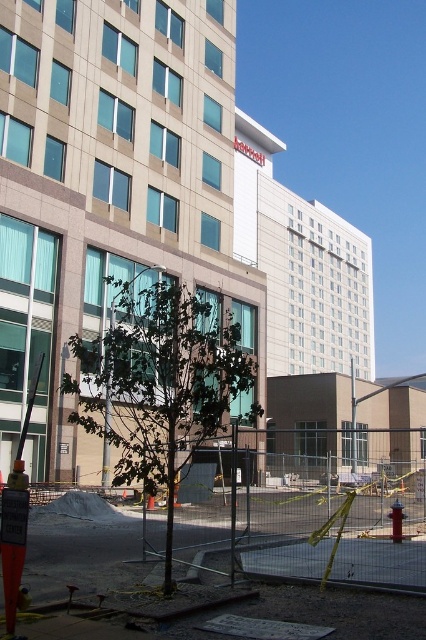
Is beige glass hotel at center in front of green leafy tree at center?

That is False.

Is beige glass hotel at center to the left of green leafy tree at center from the viewer's perspective?

Indeed, beige glass hotel at center is positioned on the left side of green leafy tree at center.

This screenshot has height=640, width=426. What are the coordinates of `beige glass hotel at center` in the screenshot? It's located at (109, 188).

From the picture: Measure the distance from green leafy tree at center to white smooth hotel at upper center.

A distance of 61.87 meters exists between green leafy tree at center and white smooth hotel at upper center.

Between green leafy tree at center and white smooth hotel at upper center, which one appears on the left side from the viewer's perspective?

green leafy tree at center

Is point (252, 378) farther from camera compared to point (279, 316)?

No, (252, 378) is closer to viewer.

This screenshot has height=640, width=426. What are the coordinates of `green leafy tree at center` in the screenshot? It's located at (160, 385).

Is beige glass hotel at center taller than white smooth hotel at upper center?

No.

Can you confirm if beige glass hotel at center is thinner than white smooth hotel at upper center?

Correct, beige glass hotel at center's width is less than white smooth hotel at upper center's.

Who is more distant from viewer, [8,413] or [354,352]?

The point [354,352] is behind.

Find the location of a particular element. This screenshot has height=640, width=426. beige glass hotel at center is located at coordinates (109, 188).